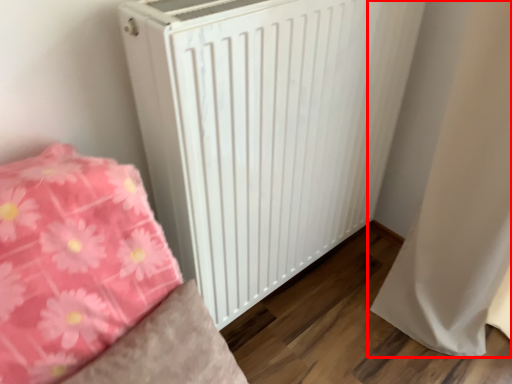
Question: From the image's perspective, considering the relative positions of curtain (annotated by the red box) and radiator in the image provided, where is curtain (annotated by the red box) located with respect to the staircase?

Choices:
 (A) below
 (B) above

Answer: (A)